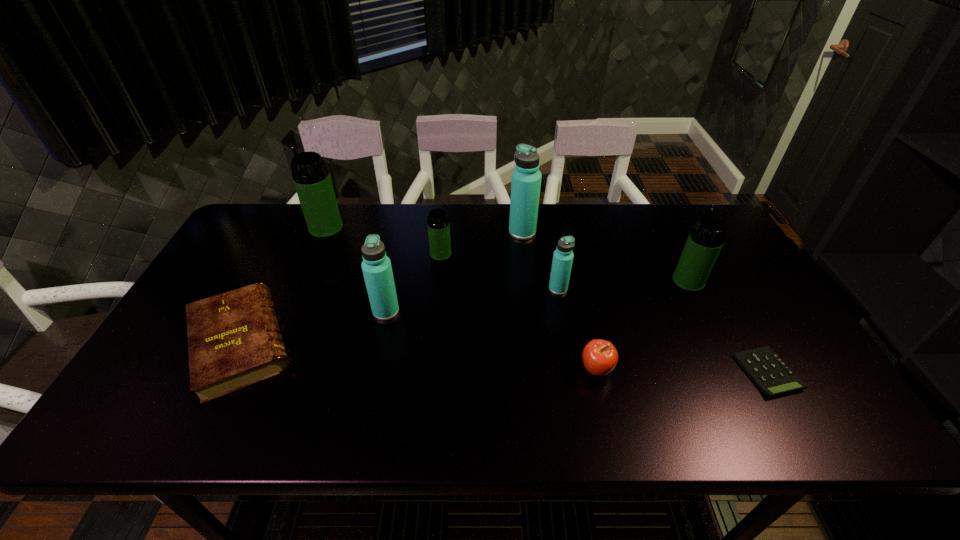
This screenshot has height=540, width=960. Identify the location of vacant space located from the spout of the nearest green thermos bottle. (669, 243).

At what (x,y) coordinates should I click in order to perform the action: click on vacant space situated 0.150m from the spout of the nearest green thermos bottle. Please return your answer as a coordinate pair (x, y). Looking at the image, I should click on click(x=667, y=239).

At what (x,y) coordinates should I click in order to perform the action: click on blank area located from the spout of the nearest green thermos bottle. Please return your answer as a coordinate pair (x, y). Looking at the image, I should click on (659, 221).

Locate an element on the screen. The image size is (960, 540). free space located 0.280m on the front of the nearest thermos bottle is located at coordinates (363, 417).

In order to click on free space located 0.300m from the spout of the third farthest object in this screenshot , I will do `click(432, 338)`.

The image size is (960, 540). What are the coordinates of `free space located 0.070m on the front of the fifth thermos bottle from left to right` in the screenshot? It's located at (563, 314).

Locate an element on the screen. The width and height of the screenshot is (960, 540). vacant position located on the left of the apple is located at coordinates (500, 369).

Identify the location of free location located 0.370m on the right of the second shortest object. (449, 343).

You are a GUI agent. You are given a task and a screenshot of the screen. Output one action in this format:
    pyautogui.click(x=<x>, y=<y>)
    Task: Click on the free point located on the back of the calculator
    
    Given the screenshot: What is the action you would take?
    pyautogui.click(x=697, y=249)

Locate an element on the screen. object at the near edge is located at coordinates (234, 341).